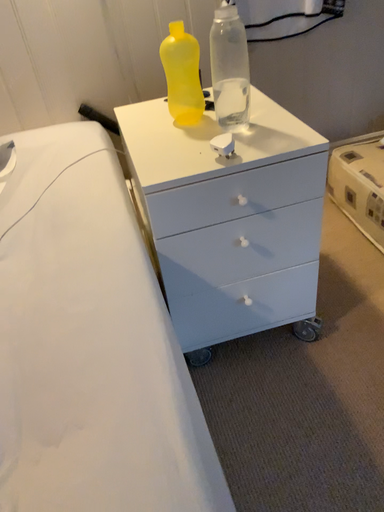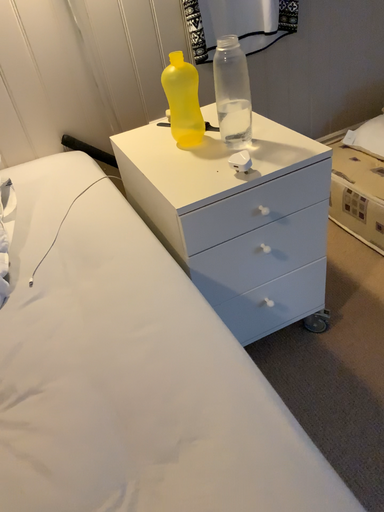
Question: How did the camera likely rotate when shooting the video?

Choices:
 (A) rotated right
 (B) rotated left

Answer: (A)